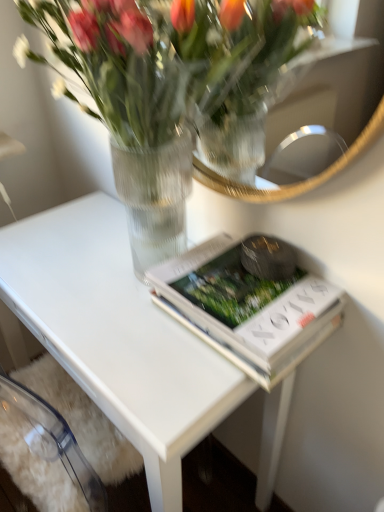
Question: Is white matte book at center situated inside clear glass vase at upper center or outside?

Choices:
 (A) inside
 (B) outside

Answer: (A)

Question: Is point (304, 284) closer or farther from the camera than point (188, 6)?

Choices:
 (A) farther
 (B) closer

Answer: (A)

Question: Which object is positioned closest to the white glossy table at center?

Choices:
 (A) clear glass vase at upper center
 (B) white matte book at center

Answer: (B)

Question: Considering the real-world distances, which object is closest to the clear glass vase at upper center?

Choices:
 (A) white glossy table at center
 (B) white matte book at center

Answer: (B)